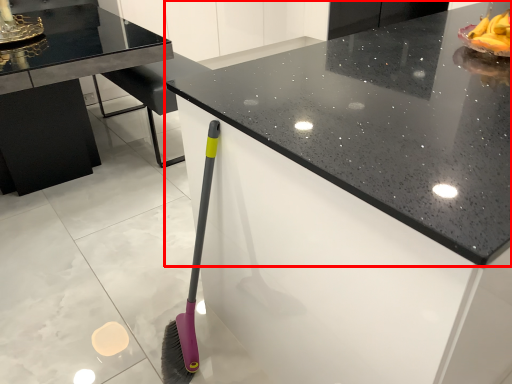
Question: Observing the image, what is the correct spatial positioning of countertop (annotated by the red box) in reference to table?

Choices:
 (A) left
 (B) right

Answer: (B)